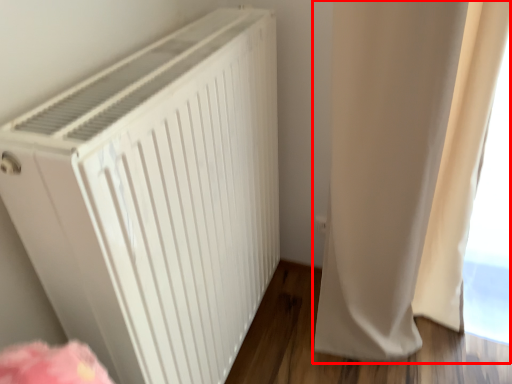
Question: From the image's perspective, where is curtain (annotated by the red box) located in relation to home appliance in the image?

Choices:
 (A) above
 (B) below

Answer: (A)